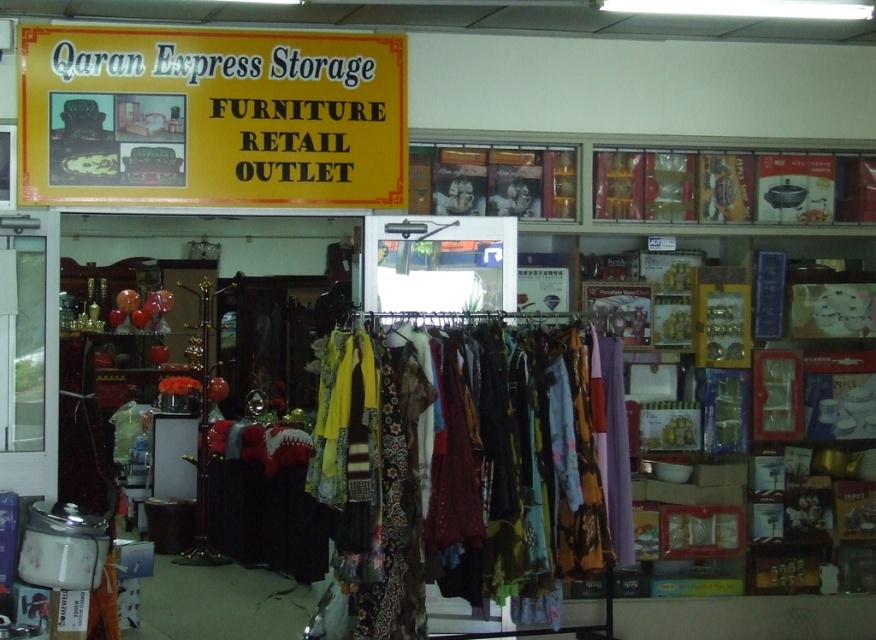
You are a customer entering the Qaran Express Storage Furniture Retail Outlet. You see a multicolored fabric dress at center and a yellow paper sign at upper center. Which object is taller?

The multicolored fabric dress at center is taller than the yellow paper sign at upper center.